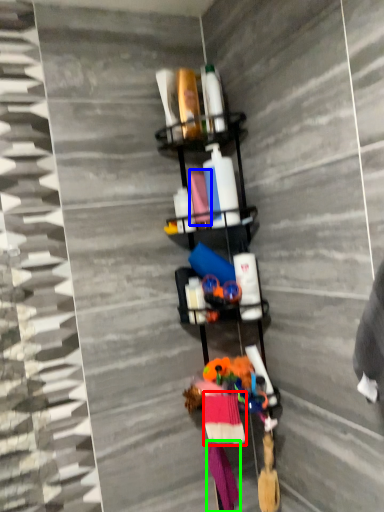
Question: Which object is positioned closest to clothing (highlighted by a red box)? Select from fabric (highlighted by a blue box) and clothing (highlighted by a green box).

Choices:
 (A) fabric
 (B) clothing

Answer: (B)